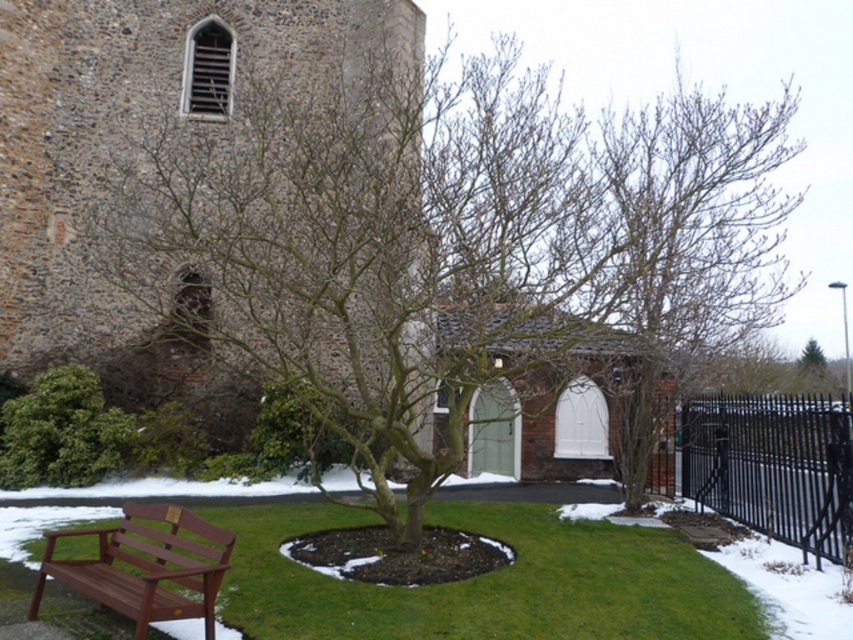
You are planning to plant flowers in the green grass at lower left and along the black wrought iron fence at lower right. Which area would allow you to plant more flowers due to having more space?

The black wrought iron fence at lower right allows planting more flowers because it occupies more space than the green grass at lower left.

You are a photographer planning to take a photo of the brown stone church at upper left and the black wrought iron fence at lower right. From your current position, which object is closer to you? Please explain based on their positions.

The black wrought iron fence at lower right is closer to you because it is positioned under the brown stone church at upper left, meaning the fence is lower in the image and thus nearer to the viewer.

You are standing in front of the brown stone church at upper left and want to take a photo of it. If your camera can focus on objects up to 10 meters away, will you be able to capture the church clearly?

The brown stone church at upper left is 12.63 meters away from the viewer. Since the camera can only focus up to 10 meters, you will not be able to capture the church clearly.